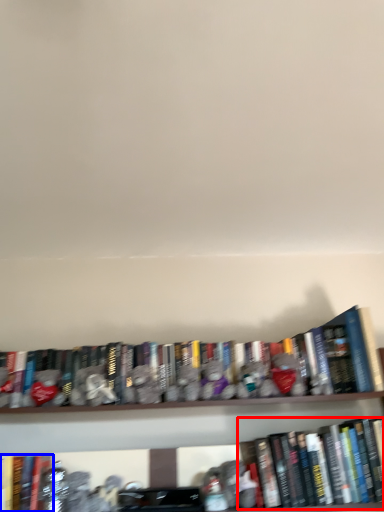
Question: Which object is closer to the camera taking this photo, book (highlighted by a red box) or book (highlighted by a blue box)?

Choices:
 (A) book
 (B) book

Answer: (B)